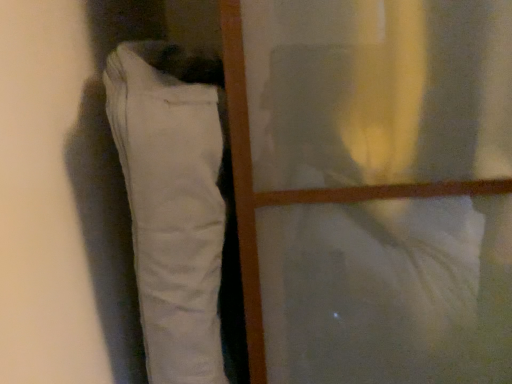
This screenshot has height=384, width=512. What do you see at coordinates (170, 210) in the screenshot?
I see `white cotton trousers at left` at bounding box center [170, 210].

Locate an element on the screen. Image resolution: width=512 pixels, height=384 pixels. white cotton trousers at left is located at coordinates (170, 210).

What are the coordinates of `white cotton trousers at left` in the screenshot? It's located at (170, 210).